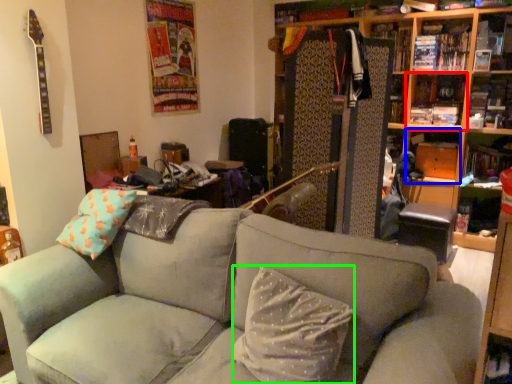
Question: Based on their relative distances, which object is farther from shelf (highlighted by a red box)? Choose from shelf (highlighted by a blue box) and pillow (highlighted by a green box).

Choices:
 (A) shelf
 (B) pillow

Answer: (B)